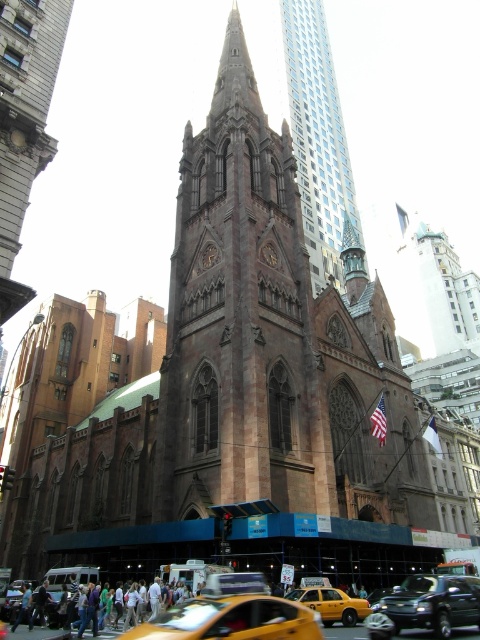
Can you confirm if brown stone tower at center is smaller than shiny black sedan at center?

No.

Looking at this image, does brown stone tower at center have a lesser height compared to shiny black sedan at center?

No.

Is point (335, 500) farther from camera compared to point (430, 612)?

Yes, it is.

The height and width of the screenshot is (640, 480). Find the location of `brown stone tower at center`. brown stone tower at center is located at coordinates (241, 320).

Can you confirm if yellow matte taxi at lower center is taller than yellow matte taxi at center?

Indeed, yellow matte taxi at lower center has a greater height compared to yellow matte taxi at center.

Is yellow matte taxi at lower center to the left of yellow matte taxi at center from the viewer's perspective?

Yes, yellow matte taxi at lower center is to the left of yellow matte taxi at center.

I want to click on yellow matte taxi at lower center, so click(231, 620).

At what (x,y) coordinates should I click in order to perform the action: click on yellow matte taxi at lower center. Please return your answer as a coordinate pair (x, y). Image resolution: width=480 pixels, height=640 pixels. Looking at the image, I should click on (231, 620).

What do you see at coordinates (316, 138) in the screenshot? The image size is (480, 640). I see `glassy steel skyscraper at upper center` at bounding box center [316, 138].

Is point (312, 88) closer to viewer compared to point (282, 605)?

No, (312, 88) is further to viewer.

Is point (313, 109) farther from viewer compared to point (135, 627)?

Yes, point (313, 109) is farther from viewer.

Where is `glassy steel skyscraper at upper center`? This screenshot has width=480, height=640. glassy steel skyscraper at upper center is located at coordinates [x=316, y=138].